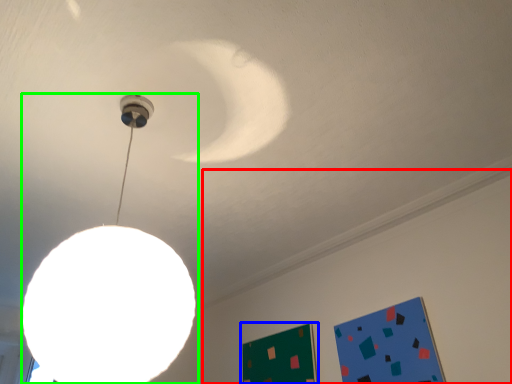
Question: Which object is positioned farthest from backdrop (highlighted by a red box)? Select from bulletin board (highlighted by a blue box) and lamp (highlighted by a green box).

Choices:
 (A) bulletin board
 (B) lamp

Answer: (B)